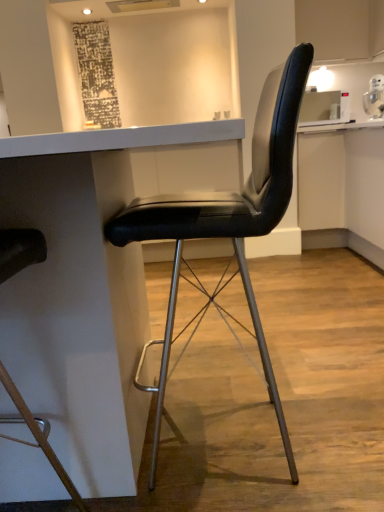
In order to face black leather chair at center, the first chair positioned from the left, should I rotate leftwards or rightwards?

A 27.897 degree turn to the left will do.

This screenshot has height=512, width=384. Describe the element at coordinates (20, 250) in the screenshot. I see `black leather chair at center, which is the 2th chair in right-to-left order` at that location.

Image resolution: width=384 pixels, height=512 pixels. Find the location of `black leather chair at center, the 1th chair when ordered from right to left`. black leather chair at center, the 1th chair when ordered from right to left is located at coordinates (229, 218).

Locate an element on the screen. The height and width of the screenshot is (512, 384). white glossy table at center is located at coordinates (94, 281).

Between white glossy table at center and black leather chair at center, the 2th chair positioned from the left, which one has smaller size?

Smaller between the two is black leather chair at center, the 2th chair positioned from the left.

Is white glossy table at center behind black leather chair at center, the 2th chair positioned from the left?

No, white glossy table at center is in front of black leather chair at center, the 2th chair positioned from the left.

Is white glossy table at center facing away from black leather chair at center, the 2th chair positioned from the left?

white glossy table at center is not turned away from black leather chair at center, the 2th chair positioned from the left.

Which is correct: white glossy table at center is inside black leather chair at center, the 1th chair when ordered from right to left, or outside of it?

white glossy table at center is spatially situated outside black leather chair at center, the 1th chair when ordered from right to left.

From the image's perspective, is black leather chair at center, the 1th chair when ordered from right to left, above white glossy table at center?

Yes, from the image's perspective, black leather chair at center, the 1th chair when ordered from right to left, is on top of white glossy table at center.

Considering the relative positions of black leather chair at center, the 1th chair when ordered from right to left, and white glossy table at center in the image provided, is black leather chair at center, the 1th chair when ordered from right to left, to the left of white glossy table at center from the viewer's perspective?

In fact, black leather chair at center, the 1th chair when ordered from right to left, is to the right of white glossy table at center.

Can you tell me how much black leather chair at center, the 1th chair when ordered from right to left, and white glossy table at center differ in facing direction?

The facing directions of black leather chair at center, the 1th chair when ordered from right to left, and white glossy table at center are 88.3 degrees apart.

Is point (251, 295) farther from viewer compared to point (44, 170)?

Yes.

Considering the relative sizes of black leather chair at center, the 2th chair positioned from the left, and black leather chair at center, the first chair positioned from the left, in the image provided, is black leather chair at center, the 2th chair positioned from the left, taller than black leather chair at center, the first chair positioned from the left,?

Yes, black leather chair at center, the 2th chair positioned from the left, is taller than black leather chair at center, the first chair positioned from the left.

Which object is positioned more to the right, black leather chair at center, the 1th chair when ordered from right to left, or black leather chair at center, which is the 2th chair in right-to-left order?

From the viewer's perspective, black leather chair at center, the 1th chair when ordered from right to left, appears more on the right side.

From the image's perspective, who appears lower, black leather chair at center, the 1th chair when ordered from right to left, or black leather chair at center, which is the 2th chair in right-to-left order?

From the image's view, black leather chair at center, which is the 2th chair in right-to-left order, is below.

Considering the sizes of white glossy table at center and black leather chair at center, the first chair positioned from the left, in the image, is white glossy table at center taller or shorter than black leather chair at center, the first chair positioned from the left,?

Clearly, white glossy table at center is shorter compared to black leather chair at center, the first chair positioned from the left.

From the image's perspective, which object appears higher, white glossy table at center or black leather chair at center, the first chair positioned from the left?

white glossy table at center is shown above in the image.

How far apart are white glossy table at center and black leather chair at center, the first chair positioned from the left?

white glossy table at center and black leather chair at center, the first chair positioned from the left, are 11.51 inches apart.

What are the coordinates of `chair on the left of the white glossy table at center` in the screenshot? It's located at (20, 250).

Can you confirm if black leather chair at center, the first chair positioned from the left, is positioned to the left of white glossy table at center?

Yes.

Which is further, (33,260) or (86,277)?

The point (86,277) is farther.

Which is behind, black leather chair at center, the first chair positioned from the left, or white glossy table at center?

white glossy table at center is further from the camera.

Is there a large distance between black leather chair at center, which is the 2th chair in right-to-left order, and black leather chair at center, the 1th chair when ordered from right to left?

That's not correct — black leather chair at center, which is the 2th chair in right-to-left order, is a little close to black leather chair at center, the 1th chair when ordered from right to left.

Which is in front, black leather chair at center, the first chair positioned from the left, or black leather chair at center, the 1th chair when ordered from right to left?

black leather chair at center, the first chair positioned from the left.

Considering the sizes of objects black leather chair at center, the first chair positioned from the left, and black leather chair at center, the 1th chair when ordered from right to left, in the image provided, who is wider, black leather chair at center, the first chair positioned from the left, or black leather chair at center, the 1th chair when ordered from right to left,?

black leather chair at center, the 1th chair when ordered from right to left.

Looking at this image, between black leather chair at center, which is the 2th chair in right-to-left order, and black leather chair at center, the 2th chair positioned from the left, which one has larger size?

black leather chair at center, the 2th chair positioned from the left.

This screenshot has height=512, width=384. In order to click on chair above the white glossy table at center (from the image's perspective) in this screenshot , I will do `click(229, 218)`.

The width and height of the screenshot is (384, 512). Identify the location of table lying in front of the black leather chair at center, the 2th chair positioned from the left. (94, 281).

Estimate the real-world distances between objects in this image. Which object is closer to black leather chair at center, which is the 2th chair in right-to-left order, white glossy table at center or black leather chair at center, the 2th chair positioned from the left?

white glossy table at center is positioned closer to the anchor black leather chair at center, which is the 2th chair in right-to-left order.

Looking at the image, which one is located further to white glossy table at center, black leather chair at center, the 2th chair positioned from the left, or black leather chair at center, which is the 2th chair in right-to-left order?

black leather chair at center, which is the 2th chair in right-to-left order, is positioned further to the anchor white glossy table at center.

Considering their positions, is black leather chair at center, the 2th chair positioned from the left, positioned closer to black leather chair at center, which is the 2th chair in right-to-left order, than white glossy table at center?

white glossy table at center lies closer to black leather chair at center, which is the 2th chair in right-to-left order, than the other object.

When comparing their distances from white glossy table at center, does black leather chair at center, which is the 2th chair in right-to-left order, or black leather chair at center, the 2th chair positioned from the left, seem further?

black leather chair at center, which is the 2th chair in right-to-left order, is further to white glossy table at center.

When comparing their distances from black leather chair at center, the 2th chair positioned from the left, does white glossy table at center or black leather chair at center, the first chair positioned from the left, seem further?

The object further to black leather chair at center, the 2th chair positioned from the left, is black leather chair at center, the first chair positioned from the left.

From the image, which object appears to be farther from black leather chair at center, the 2th chair positioned from the left, black leather chair at center, the first chair positioned from the left, or white glossy table at center?

black leather chair at center, the first chair positioned from the left.

The image size is (384, 512). I want to click on table between black leather chair at center, the first chair positioned from the left, and black leather chair at center, the 1th chair when ordered from right to left, so click(x=94, y=281).